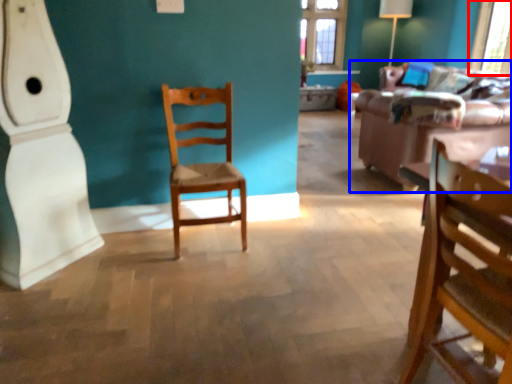
Question: Among these objects, which one is nearest to the camera, window screen (highlighted by a red box) or studio couch (highlighted by a blue box)?

Choices:
 (A) window screen
 (B) studio couch

Answer: (B)